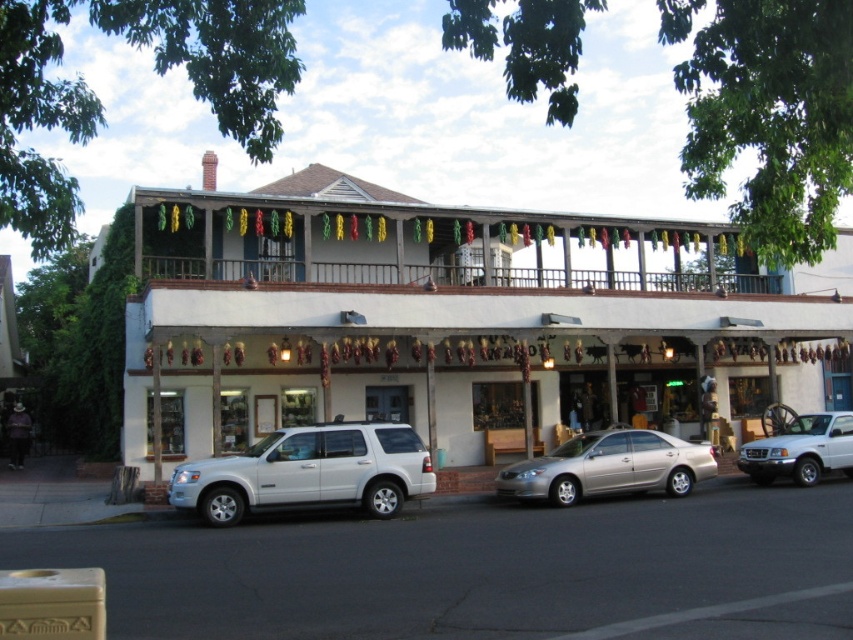
Question: Which object appears farthest from the camera in this image?

Choices:
 (A) white matte truck at lower right
 (B) white matte building at center
 (C) satin gold sedan at center

Answer: (A)

Question: Does white matte building at center appear under satin gold sedan at center?

Choices:
 (A) no
 (B) yes

Answer: (A)

Question: Which object is positioned farthest from the white matte truck at lower right?

Choices:
 (A) satin gold sedan at center
 (B) white matte building at center

Answer: (B)

Question: Which object is the farthest from the white matte truck at lower right?

Choices:
 (A) white matte suv at lower left
 (B) white matte building at center

Answer: (A)

Question: Can you confirm if white matte suv at lower left is positioned to the left of white matte truck at lower right?

Choices:
 (A) no
 (B) yes

Answer: (B)

Question: Does white matte building at center lie behind white matte suv at lower left?

Choices:
 (A) yes
 (B) no

Answer: (A)